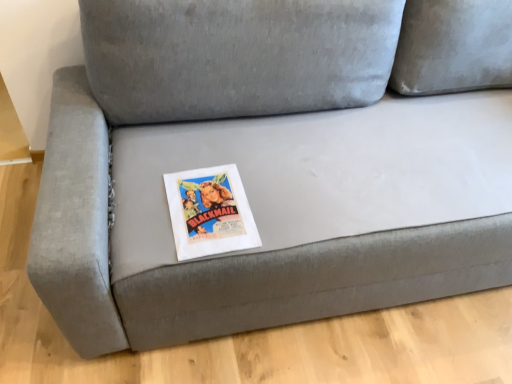
Locate an element on the screen. vacant space situated above white paper book at center (from a real-world perspective) is located at coordinates (208, 203).